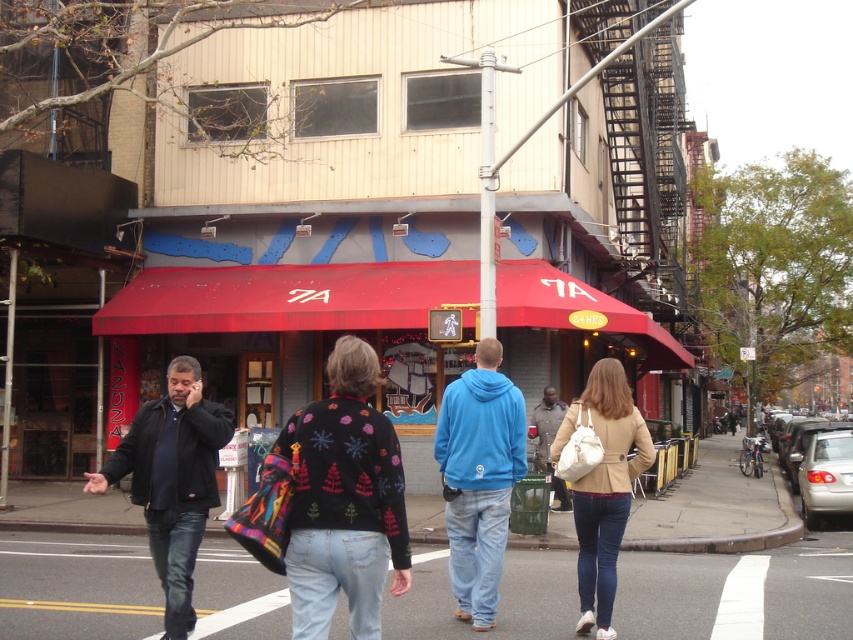
Measure the distance from black sweater with colorful patterns at center to blue cotton hoodie at center.

8.67 feet

The width and height of the screenshot is (853, 640). I want to click on black sweater with colorful patterns at center, so click(344, 500).

At what (x,y) coordinates should I click in order to perform the action: click on black sweater with colorful patterns at center. Please return your answer as a coordinate pair (x, y). The image size is (853, 640). Looking at the image, I should click on (344, 500).

Can you confirm if smooth asphalt road at center is taller than black sweater with colorful patterns at center?

No, smooth asphalt road at center is not taller than black sweater with colorful patterns at center.

Who is more distant from viewer, (102, 616) or (289, 588)?

Point (102, 616)

This screenshot has width=853, height=640. I want to click on smooth asphalt road at center, so click(76, 586).

Locate an element on the screen. Image resolution: width=853 pixels, height=640 pixels. dark blue jacket at left is located at coordinates (172, 481).

Who is more forward, (171,380) or (614,436)?

Point (171,380) is in front.

In order to click on dark blue jacket at left in this screenshot , I will do `click(172, 481)`.